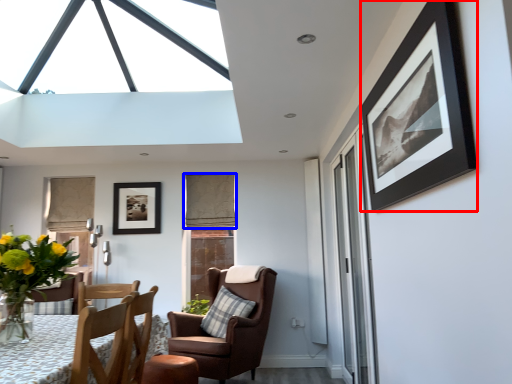
Question: Among these objects, which one is nearest to the camera, picture frame (highlighted by a red box) or curtain (highlighted by a blue box)?

Choices:
 (A) picture frame
 (B) curtain

Answer: (A)